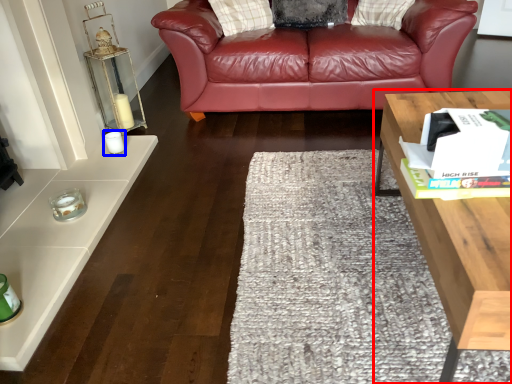
Question: Which of the following is the closest to the observer, table (highlighted by a red box) or candle holder (highlighted by a blue box)?

Choices:
 (A) table
 (B) candle holder

Answer: (A)